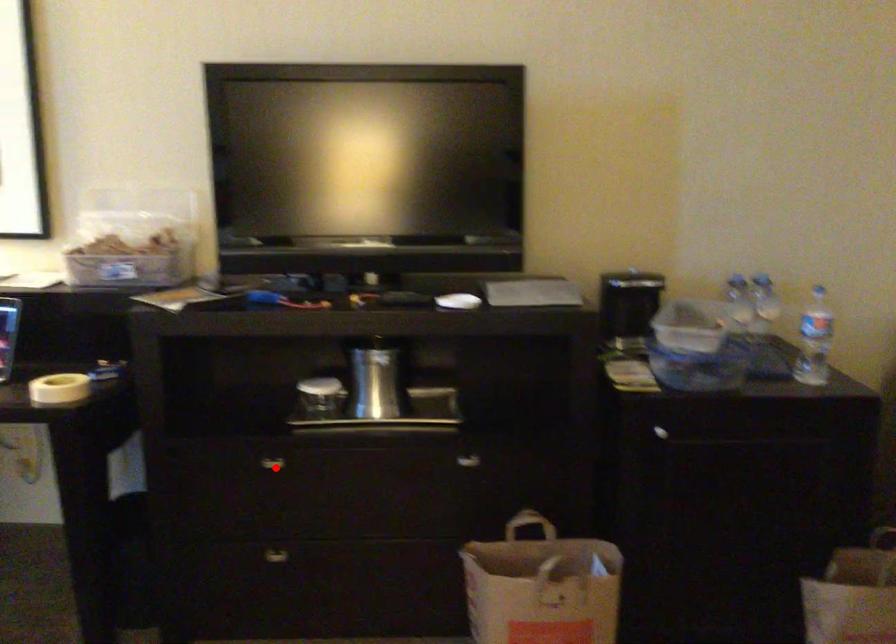
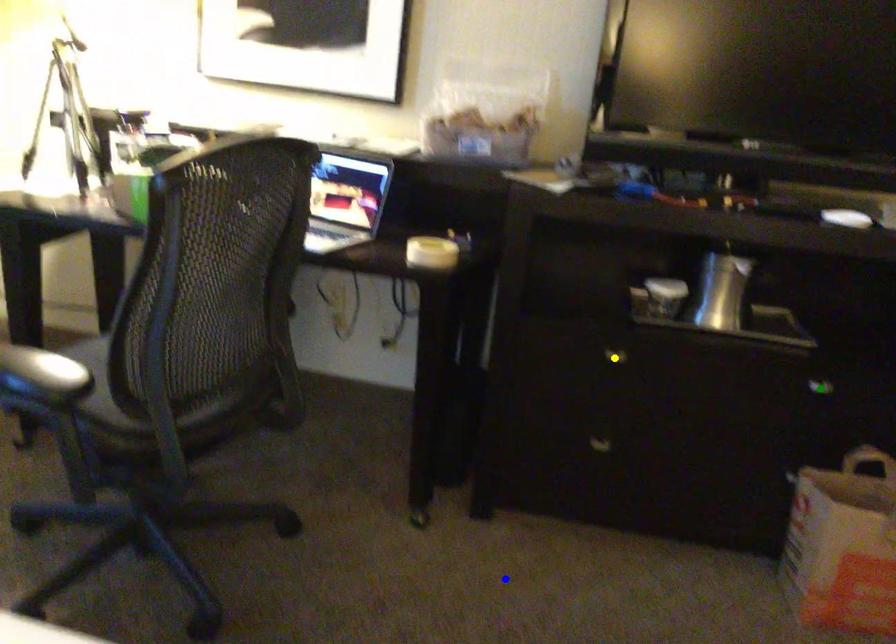
Question: I am providing you with two images of the same scene from different viewpoints. A red point is marked on the first image. You are given multiple points on the second image. In image 2, which mark is for the same physical point as the one in image 1?

Choices:
 (A) yellow point
 (B) blue point
 (C) green point

Answer: (A)